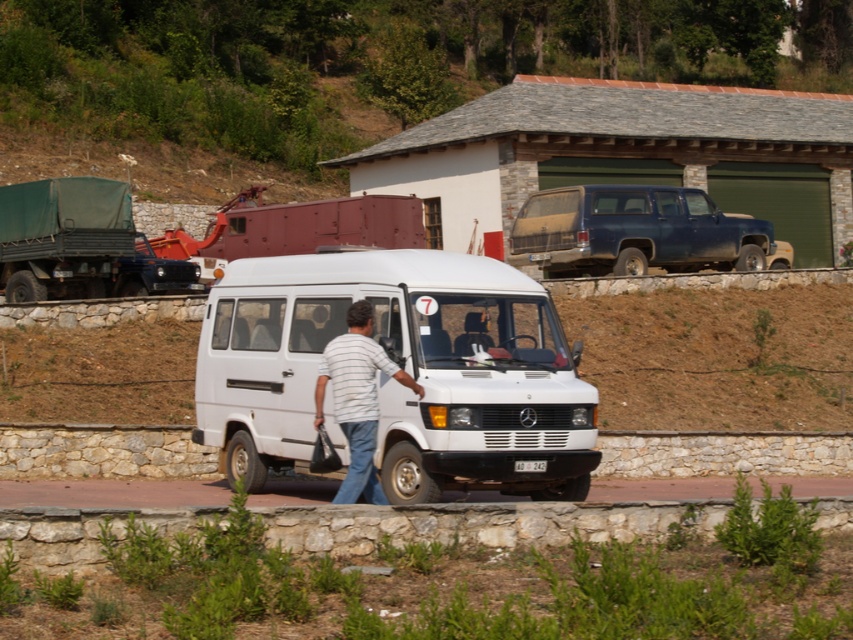
Question: Which point appears closest to the camera in this image?

Choices:
 (A) (672, 244)
 (B) (114, 205)
 (C) (351, 396)
 (D) (294, 371)

Answer: (C)

Question: Is white matte van at center in front of striped fabric shirt at center?

Choices:
 (A) no
 (B) yes

Answer: (A)

Question: Which point is closer to the camera?

Choices:
 (A) (483, 296)
 (B) (672, 248)
 (C) (343, 484)
 (D) (630, 538)

Answer: (D)

Question: Can you confirm if white matte van at center is positioned below green canvas truck at left?

Choices:
 (A) yes
 (B) no

Answer: (A)

Question: Which of the following is the closest to the observer?

Choices:
 (A) (367, 476)
 (B) (100, 557)

Answer: (B)

Question: Is stone curb at lower center smaller than green canvas truck at left?

Choices:
 (A) yes
 (B) no

Answer: (A)